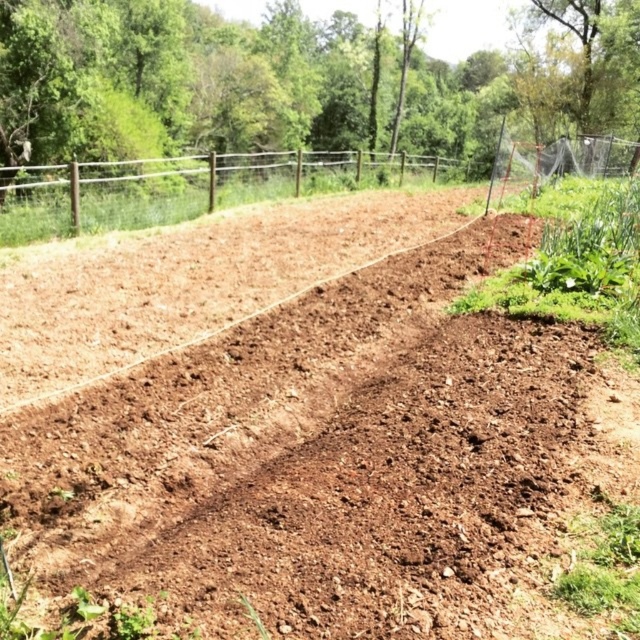
The image size is (640, 640). I want to click on brown soil at center, so click(x=337, y=464).

Is brown soil at center to the right of brown wooden fence at upper center from the viewer's perspective?

Yes, brown soil at center is to the right of brown wooden fence at upper center.

Identify the location of brown soil at center. (337, 464).